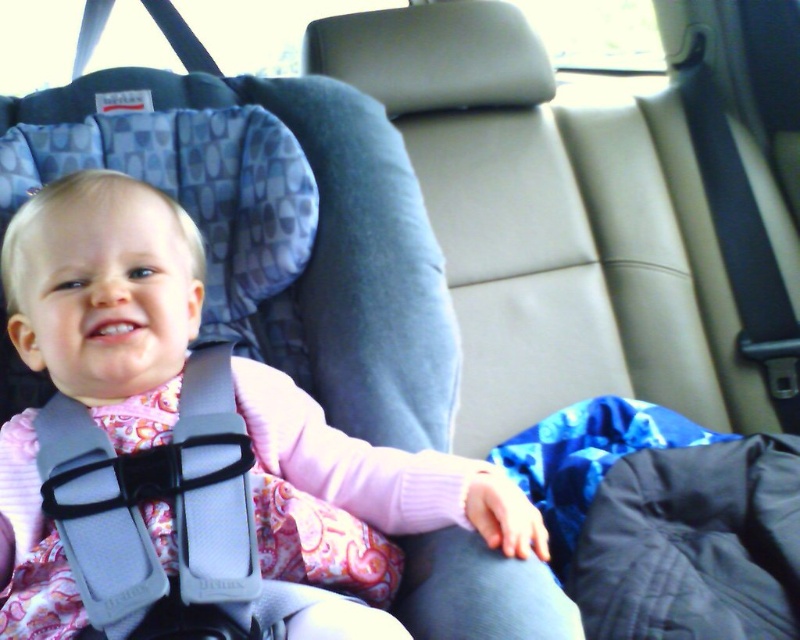
You are a safety inspector checking the car seat for a new parent. You notice two gray fabric straps in the image. Which one is narrower between the gray fabric strap at center and the gray fabric seatbelt at upper left?

The gray fabric strap at center is narrower than the gray fabric seatbelt at upper left.

You are a safety inspector checking the car seat for proper installation. You notice the gray fabric strap at center and the gray fabric seatbelt at upper left. How far apart are these two items?

The gray fabric strap at center and the gray fabric seatbelt at upper left are 1.55 meters apart from each other.